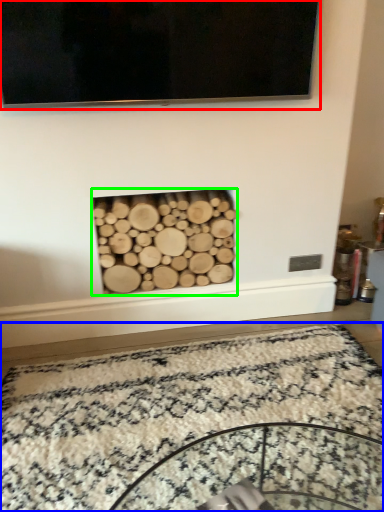
Question: Considering the real-world distances, which object is closest to television (highlighted by a red box)? mat (highlighted by a blue box) or fireplace (highlighted by a green box).

Choices:
 (A) mat
 (B) fireplace

Answer: (B)